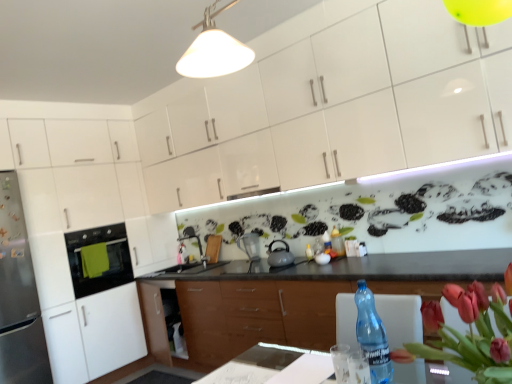
Question: From a real-world perspective, is wooden cabinet at center, which is counted as the 3th cabinetry, starting from the top, physically below white glossy cabinets at upper center, placed as the third cabinetry when sorted from bottom to top?

Choices:
 (A) no
 (B) yes

Answer: (B)

Question: Is white glossy cabinets at upper center, placed as the third cabinetry when sorted from bottom to top, completely or partially inside wooden cabinet at center, the 1th cabinetry ordered from the bottom?

Choices:
 (A) no
 (B) yes

Answer: (A)

Question: Does wooden cabinet at center, the 1th cabinetry ordered from the bottom, have a greater height compared to white glossy cabinets at upper center, placed as the first cabinetry when sorted from top to bottom?

Choices:
 (A) no
 (B) yes

Answer: (A)

Question: Can you confirm if wooden cabinet at center, the 1th cabinetry ordered from the bottom, is smaller than white glossy cabinets at upper center, placed as the third cabinetry when sorted from bottom to top?

Choices:
 (A) yes
 (B) no

Answer: (B)

Question: Considering the relative positions of wooden cabinet at center, which is counted as the 3th cabinetry, starting from the top, and white glossy cabinets at upper center, placed as the first cabinetry when sorted from top to bottom, in the image provided, is wooden cabinet at center, which is counted as the 3th cabinetry, starting from the top, behind white glossy cabinets at upper center, placed as the first cabinetry when sorted from top to bottom,?

Choices:
 (A) no
 (B) yes

Answer: (A)

Question: From the image's perspective, does wooden cabinet at center, the 1th cabinetry ordered from the bottom, appear lower than white glossy cabinets at upper center, placed as the first cabinetry when sorted from top to bottom?

Choices:
 (A) yes
 (B) no

Answer: (A)

Question: Is white glossy cabinet at left, the 2th cabinetry when ordered from bottom to top, looking in the opposite direction of white glossy cabinets at upper center, placed as the third cabinetry when sorted from bottom to top?

Choices:
 (A) no
 (B) yes

Answer: (A)

Question: Is the position of white glossy cabinet at left, the 2th cabinetry when ordered from bottom to top, more distant than that of white glossy cabinets at upper center, placed as the first cabinetry when sorted from top to bottom?

Choices:
 (A) yes
 (B) no

Answer: (A)

Question: Is white glossy cabinet at left, the 2th cabinetry when ordered from bottom to top, oriented towards white glossy cabinets at upper center, placed as the first cabinetry when sorted from top to bottom?

Choices:
 (A) yes
 (B) no

Answer: (A)

Question: Is white glossy cabinet at left, the 2th cabinetry when ordered from bottom to top, positioned in front of white glossy cabinets at upper center, placed as the first cabinetry when sorted from top to bottom?

Choices:
 (A) no
 (B) yes

Answer: (A)

Question: From the image's perspective, is white glossy cabinet at left, marked as the 2th cabinetry in a top-to-bottom arrangement, over white glossy cabinets at upper center, placed as the third cabinetry when sorted from bottom to top?

Choices:
 (A) yes
 (B) no

Answer: (B)

Question: Does white glossy cabinet at left, marked as the 2th cabinetry in a top-to-bottom arrangement, have a lesser width compared to white glossy cabinets at upper center, placed as the first cabinetry when sorted from top to bottom?

Choices:
 (A) no
 (B) yes

Answer: (A)

Question: Is matte silver pitcher at center to the left of matte gray tea pot at center from the viewer's perspective?

Choices:
 (A) no
 (B) yes

Answer: (B)